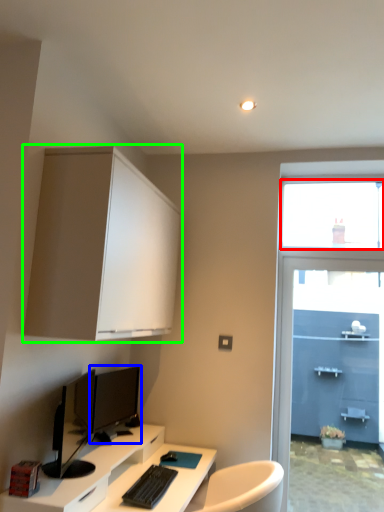
Question: Which object is positioned farthest from window screen (highlighted by a red box)? Select from computer monitor (highlighted by a blue box) and cabinetry (highlighted by a green box).

Choices:
 (A) computer monitor
 (B) cabinetry

Answer: (A)